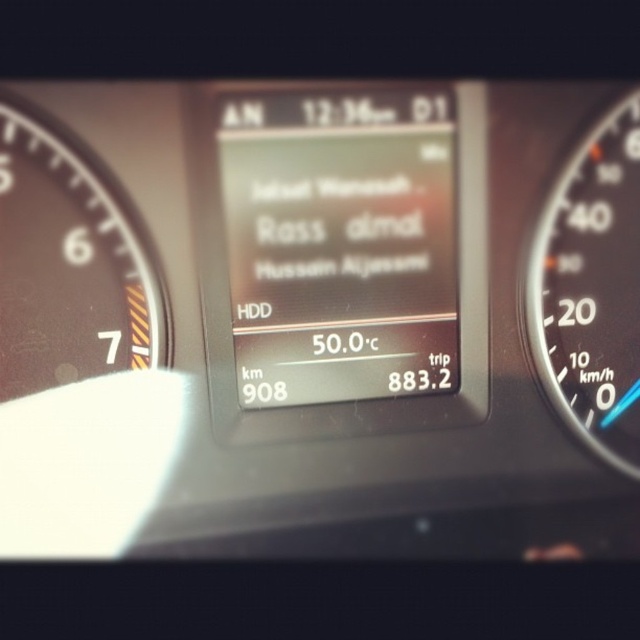
Does matte black gauge at left appear over black plastic speedometer at right?

Yes, matte black gauge at left is above black plastic speedometer at right.

Is matte black gauge at left to the right of black plastic speedometer at right from the viewer's perspective?

Incorrect, matte black gauge at left is not on the right side of black plastic speedometer at right.

Between point (156, 324) and point (609, 278), which one is positioned behind?

Point (609, 278)

The image size is (640, 640). In order to click on matte black gauge at left in this screenshot , I will do `click(70, 262)`.